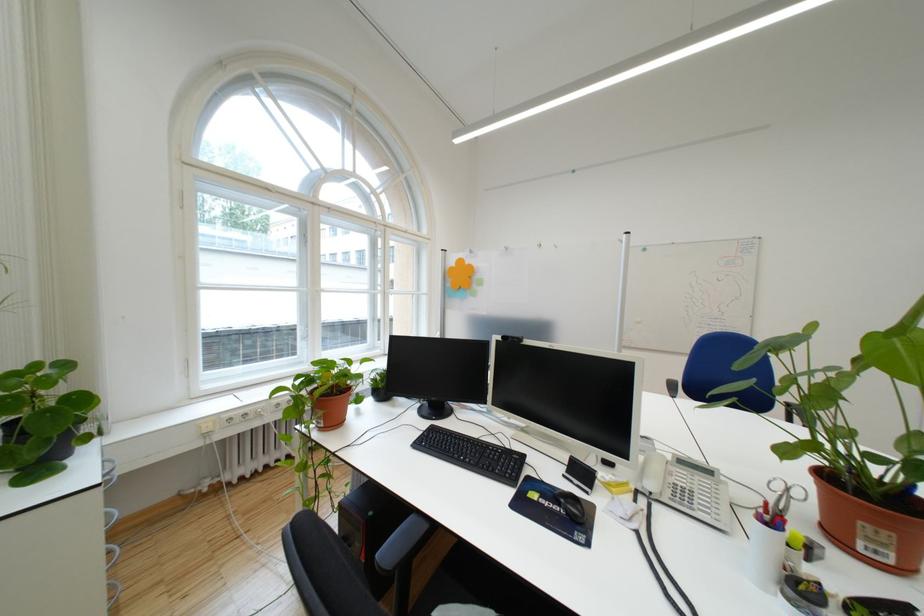
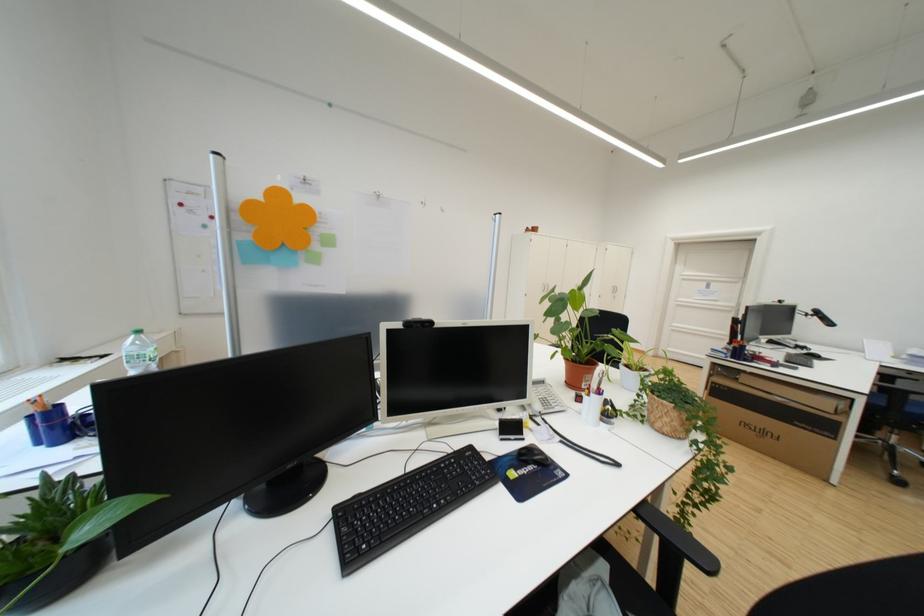
Find the pixel in the second image that matches (873,496) in the first image.

(592, 365)